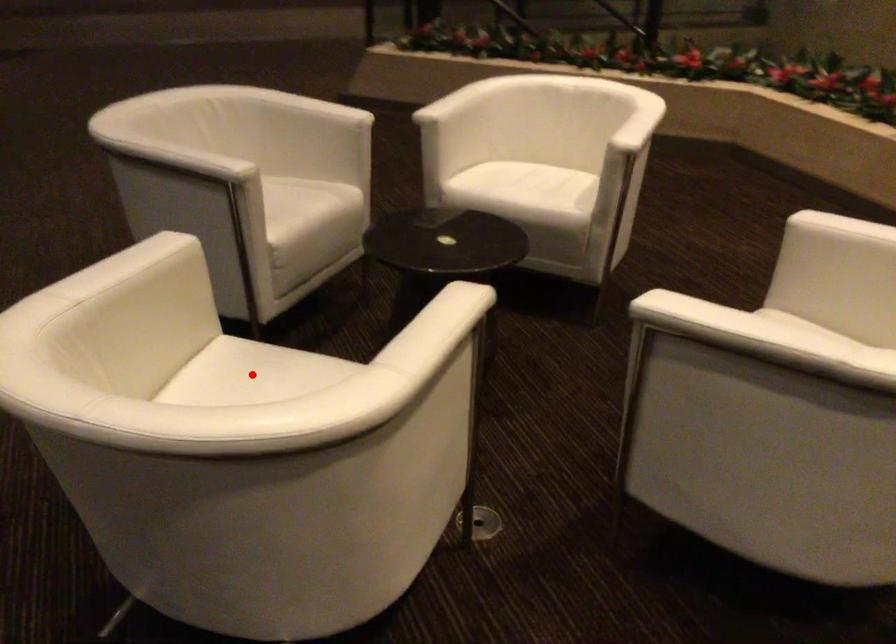
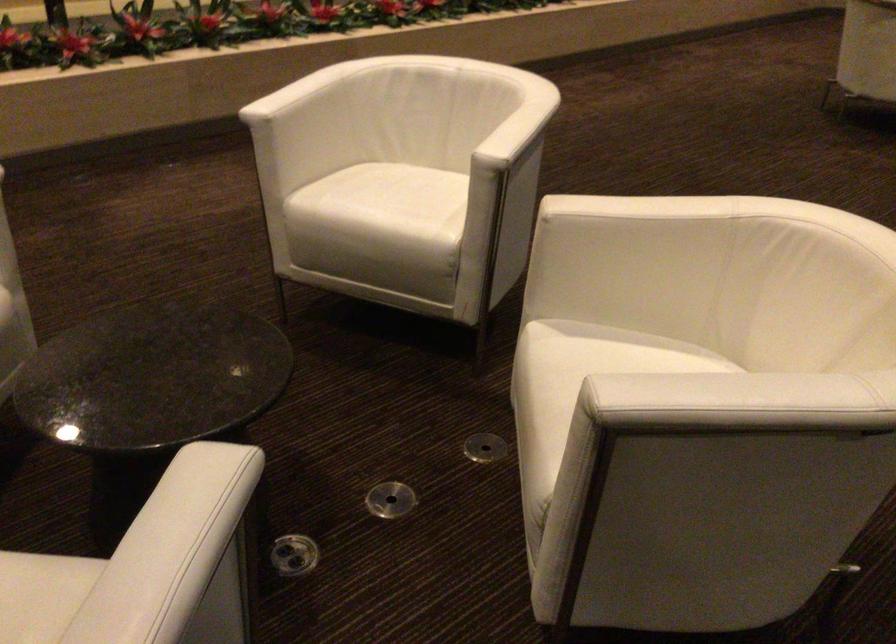
Question: I am providing you with two images of the same scene from different viewpoints. A red point is marked on the first image. Can you still see the location of the red point in image 2?

Choices:
 (A) Yes
 (B) No

Answer: (B)